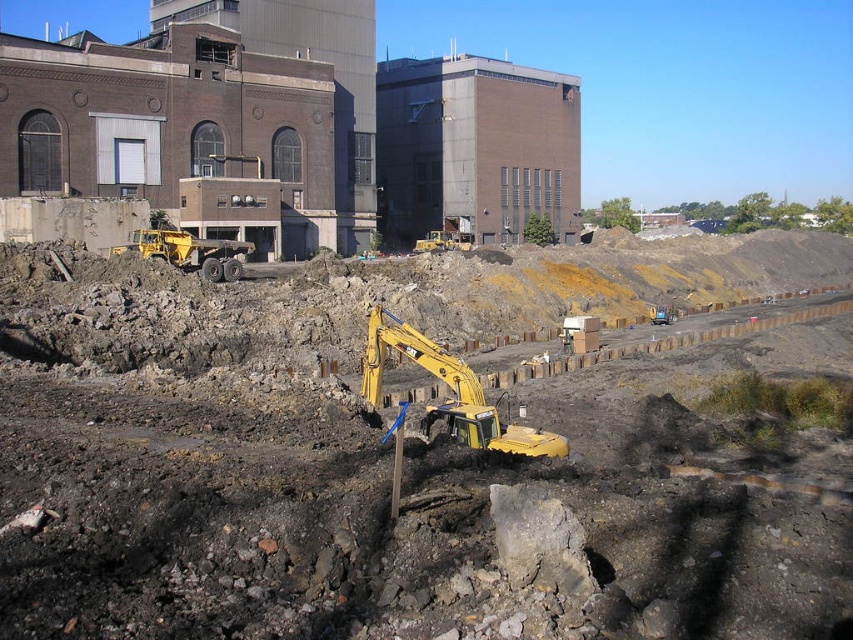
Who is more distant from viewer, (561, 433) or (426, 340)?

The point (561, 433) is more distant.

Which is more to the right, yellow metal excavator at center or yellow metallic excavator at center?

yellow metal excavator at center

Is point (428, 563) farther from camera compared to point (498, 428)?

No, (428, 563) is closer to viewer.

Image resolution: width=853 pixels, height=640 pixels. Identify the location of yellow metal excavator at center. (376, 472).

Is yellow metal excavator at center above yellow metallic excavator at left?

No.

Between yellow metal excavator at center and yellow metallic excavator at left, which one is positioned higher?

yellow metallic excavator at left is higher up.

I want to click on yellow metal excavator at center, so click(x=376, y=472).

Is yellow metallic excavator at center shorter than yellow metallic excavator at left?

No.

Does yellow metallic excavator at center have a greater height compared to yellow metallic excavator at left?

Correct, yellow metallic excavator at center is much taller as yellow metallic excavator at left.

Describe the element at coordinates (451, 392) in the screenshot. The width and height of the screenshot is (853, 640). I see `yellow metallic excavator at center` at that location.

The height and width of the screenshot is (640, 853). I want to click on yellow metallic excavator at center, so (451, 392).